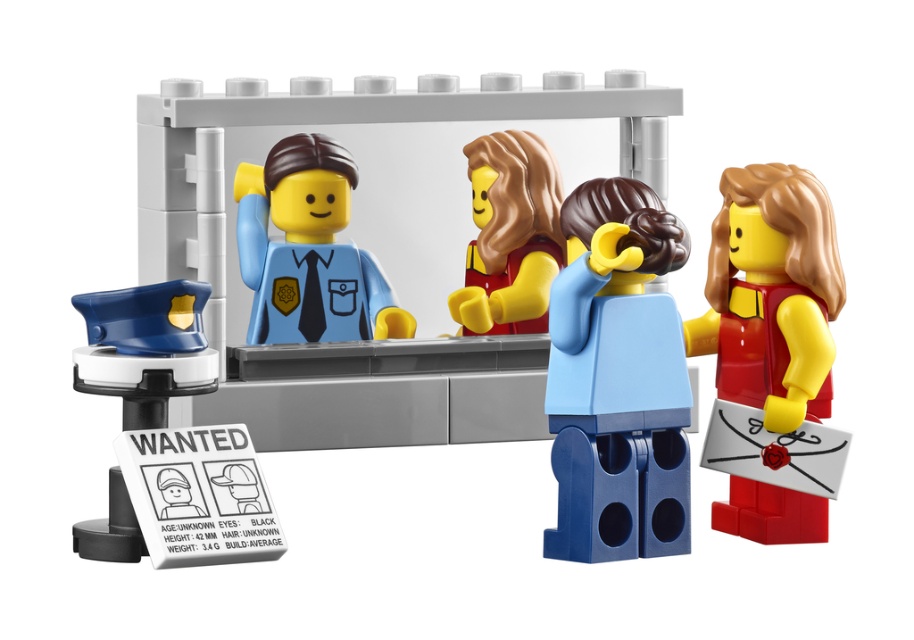
Question: Among these objects, which one is nearest to the camera?

Choices:
 (A) smooth red dress at right
 (B) matte blue uniform at center
 (C) blue plastic police hat at left

Answer: (C)

Question: Is blue matte torso at center below smooth red dress at right?

Choices:
 (A) yes
 (B) no

Answer: (A)

Question: Does blue plastic police hat at left have a smaller size compared to smooth black cap at upper left?

Choices:
 (A) yes
 (B) no

Answer: (B)

Question: Which of these objects is positioned closest to the smooth red dress at right?

Choices:
 (A) smooth black cap at upper left
 (B) smooth brown hair at center
 (C) matte blue uniform at center
 (D) blue plastic police hat at left

Answer: (B)

Question: Based on their relative distances, which object is nearer to the smooth brown hair at center?

Choices:
 (A) blue plastic police hat at left
 (B) matte blue uniform at center
 (C) blue matte torso at center
 (D) smooth black cap at upper left

Answer: (B)

Question: Does blue matte torso at center appear on the left side of matte blue uniform at center?

Choices:
 (A) yes
 (B) no

Answer: (B)